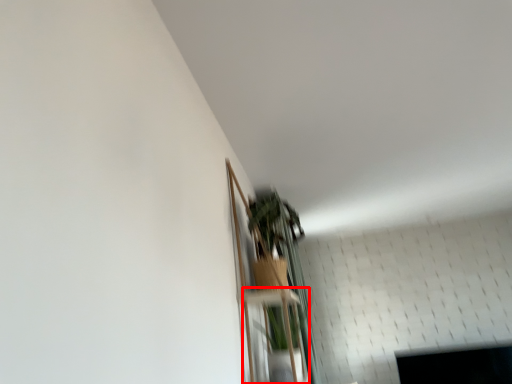
Question: Observing the image, what is the correct spatial positioning of shelf (annotated by the red box) in reference to shelf?

Choices:
 (A) left
 (B) right

Answer: (B)